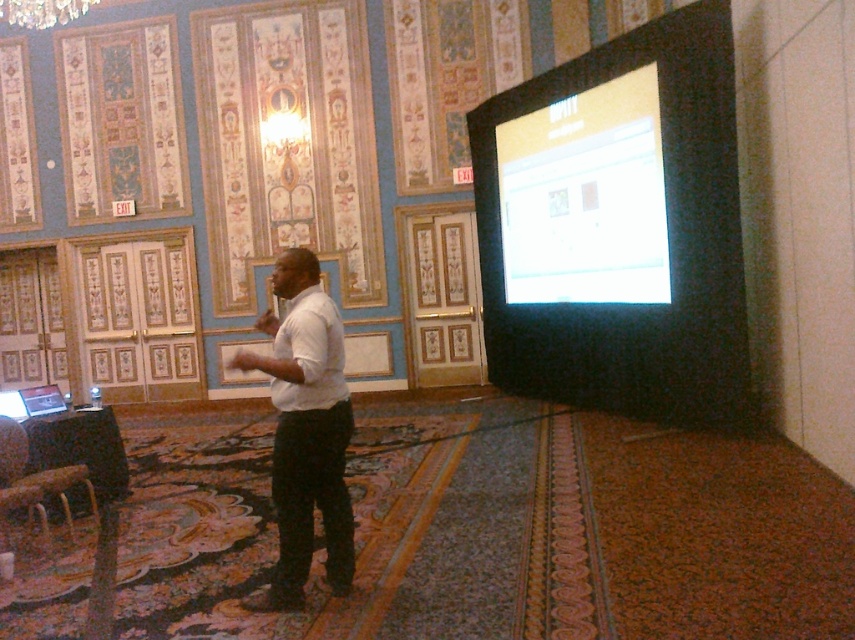
Question: Is white glossy screen at upper right behind white matte shirt at center?

Choices:
 (A) no
 (B) yes

Answer: (B)

Question: Is white glossy screen at upper right to the right of white matte shirt at center from the viewer's perspective?

Choices:
 (A) no
 (B) yes

Answer: (B)

Question: Which of the following is the farthest from the observer?

Choices:
 (A) matte black screen at right
 (B) white glossy screen at upper right

Answer: (B)

Question: Which point appears farthest from the camera in this image?

Choices:
 (A) (598, 374)
 (B) (546, 284)

Answer: (B)

Question: Among these points, which one is nearest to the camera?

Choices:
 (A) (585, 189)
 (B) (561, 307)

Answer: (A)

Question: Can you confirm if white glossy screen at upper right is smaller than white matte shirt at center?

Choices:
 (A) no
 (B) yes

Answer: (A)